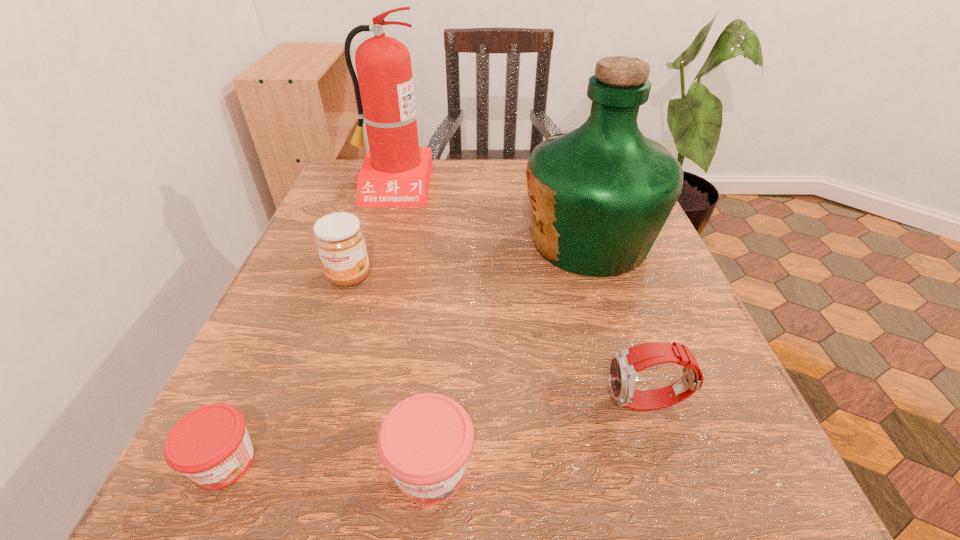
Where is `vacant space in between the fifth tallest object and the fire extinguisher`? This screenshot has width=960, height=540. vacant space in between the fifth tallest object and the fire extinguisher is located at coordinates coord(412,327).

I want to click on free spot between the watch and the tallest jam, so click(498, 340).

Image resolution: width=960 pixels, height=540 pixels. Identify the location of free space between the fire extinguisher and the farthest jam. (371, 231).

Image resolution: width=960 pixels, height=540 pixels. Find the location of `free spot between the fifth tallest object and the farthest jam`. free spot between the fifth tallest object and the farthest jam is located at coordinates (390, 373).

Locate an element on the screen. The image size is (960, 540). vacant area between the fire extinguisher and the watch is located at coordinates (520, 294).

Locate an element on the screen. vacant space in between the watch and the fourth object from left to right is located at coordinates (540, 436).

Locate which object is the third closest to the rightmost jam. Please provide its 2D coordinates. Your answer should be formatted as a tuple, i.e. [(x, y)], where the tuple contains the x and y coordinates of a point satisfying the conditions above.

[(340, 242)]

This screenshot has height=540, width=960. I want to click on object that is the fourth closest one to the farthest jam, so click(599, 195).

Locate an element on the screen. jam that can be found as the second closest to the third object from right to left is located at coordinates (340, 242).

Choose which jam is the second nearest neighbor to the shortest object. Please provide its 2D coordinates. Your answer should be formatted as a tuple, i.e. [(x, y)], where the tuple contains the x and y coordinates of a point satisfying the conditions above.

[(340, 242)]